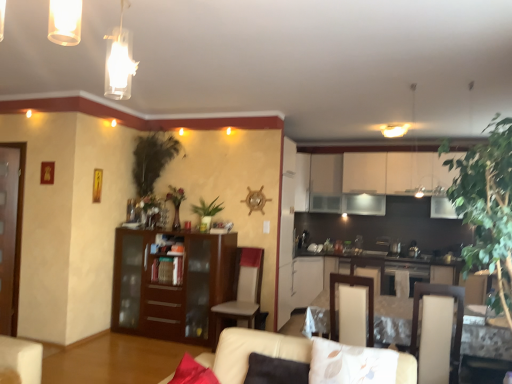
Question: Considering the relative sizes of light gray fabric chair at center and beige leather armchair at center in the image provided, is light gray fabric chair at center wider than beige leather armchair at center?

Choices:
 (A) yes
 (B) no

Answer: (A)

Question: Can you see light gray fabric chair at center touching beige leather armchair at center?

Choices:
 (A) no
 (B) yes

Answer: (A)

Question: Could you tell me if light gray fabric chair at center is turned towards beige leather armchair at center?

Choices:
 (A) yes
 (B) no

Answer: (B)

Question: Is light gray fabric chair at center smaller than beige leather armchair at center?

Choices:
 (A) yes
 (B) no

Answer: (B)

Question: Does light gray fabric chair at center lie in front of beige leather armchair at center?

Choices:
 (A) no
 (B) yes

Answer: (A)

Question: Is light gray fabric chair at center completely or partially outside of beige leather armchair at center?

Choices:
 (A) yes
 (B) no

Answer: (A)

Question: Can you confirm if floral fabric pillow at center is shorter than light gray fabric chair at center?

Choices:
 (A) yes
 (B) no

Answer: (A)

Question: Considering the relative sizes of floral fabric pillow at center and light gray fabric chair at center in the image provided, is floral fabric pillow at center bigger than light gray fabric chair at center?

Choices:
 (A) no
 (B) yes

Answer: (A)

Question: From the image's perspective, is floral fabric pillow at center on top of light gray fabric chair at center?

Choices:
 (A) yes
 (B) no

Answer: (A)

Question: From a real-world perspective, does floral fabric pillow at center sit lower than light gray fabric chair at center?

Choices:
 (A) no
 (B) yes

Answer: (A)

Question: From the image's perspective, is floral fabric pillow at center beneath light gray fabric chair at center?

Choices:
 (A) yes
 (B) no

Answer: (B)

Question: From a real-world perspective, is floral fabric pillow at center on top of light gray fabric chair at center?

Choices:
 (A) yes
 (B) no

Answer: (A)

Question: Can you confirm if green leafy plant at right, placed as the third plant when sorted from left to right, is positioned to the right of white glossy table at lower right?

Choices:
 (A) yes
 (B) no

Answer: (B)